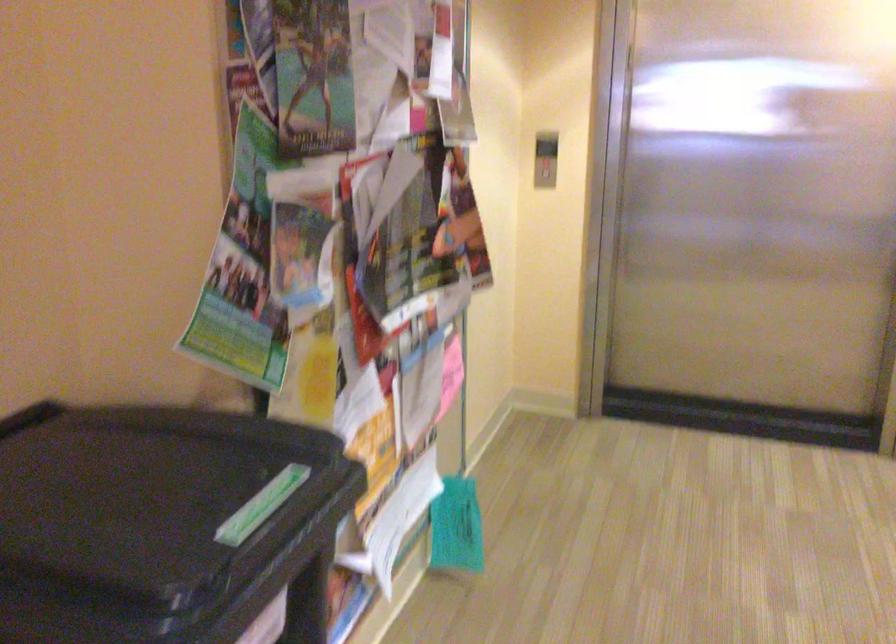
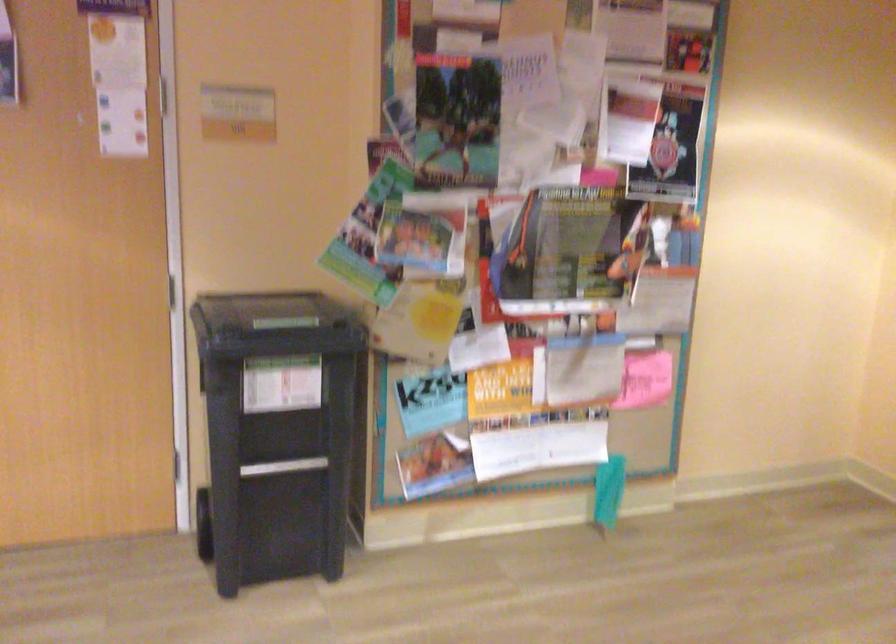
Find the pixel in the second image that matches point 234,516 in the first image.

(273, 325)